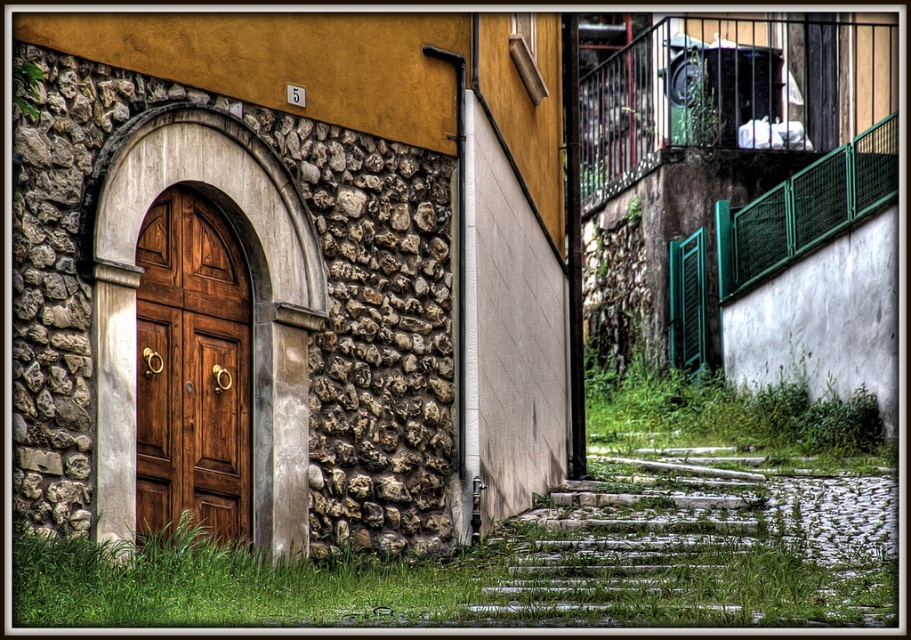
Question: Among these points, which one is farthest from the camera?

Choices:
 (A) (155, 374)
 (B) (103, 465)

Answer: (A)

Question: Is rustic stone wall at left in front of polished wood door at center left?

Choices:
 (A) no
 (B) yes

Answer: (B)

Question: In this image, where is rustic stone wall at left located relative to polished wood door at center left?

Choices:
 (A) right
 (B) left

Answer: (A)

Question: Which point appears closest to the camera in this image?

Choices:
 (A) (230, 374)
 (B) (18, 397)

Answer: (B)

Question: Observing the image, what is the correct spatial positioning of rustic stone wall at left in reference to polished wood door at center left?

Choices:
 (A) above
 (B) below

Answer: (A)

Question: Among these points, which one is nearest to the camera?

Choices:
 (A) 221,282
 (B) 285,120

Answer: (A)